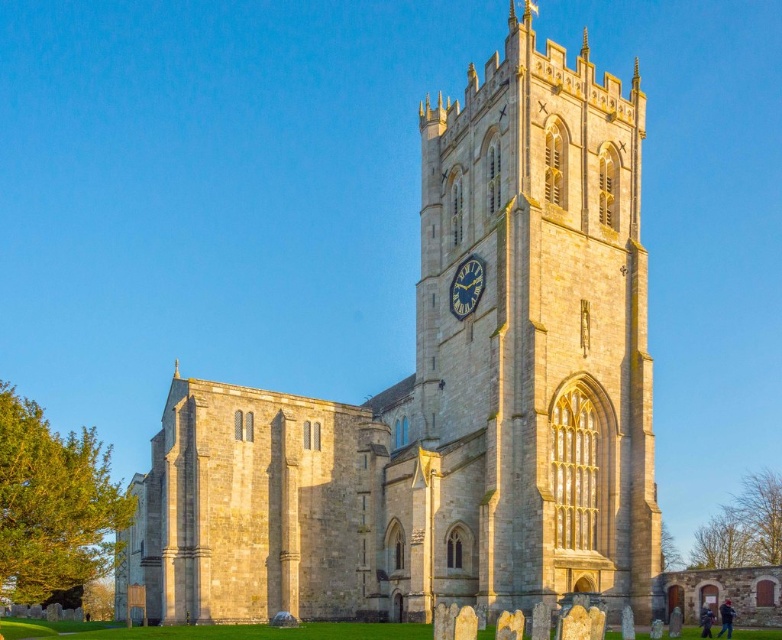
You are standing in front of the church and want to take a photo that includes both the stone church at center and the matte stone clock at center. Given that the camera can only focus on objects within a 10 meter height range, will both objects be in focus?

The stone church at center is much taller than the matte stone clock at center. Since the camera can focus on objects within a 10 meter height range, and the height difference between them is within this range, both objects will be in focus.

You are a photographer planning to capture the stone church at center and the stone clock tower at center in a single wide shot. Based on their relative sizes, which structure should you position closer to the camera to ensure both are clearly visible in the frame?

Since the stone church at center is wider than the stone clock tower at center, positioning the stone church at center closer to the camera will help balance their sizes in the frame, ensuring both are clearly visible.